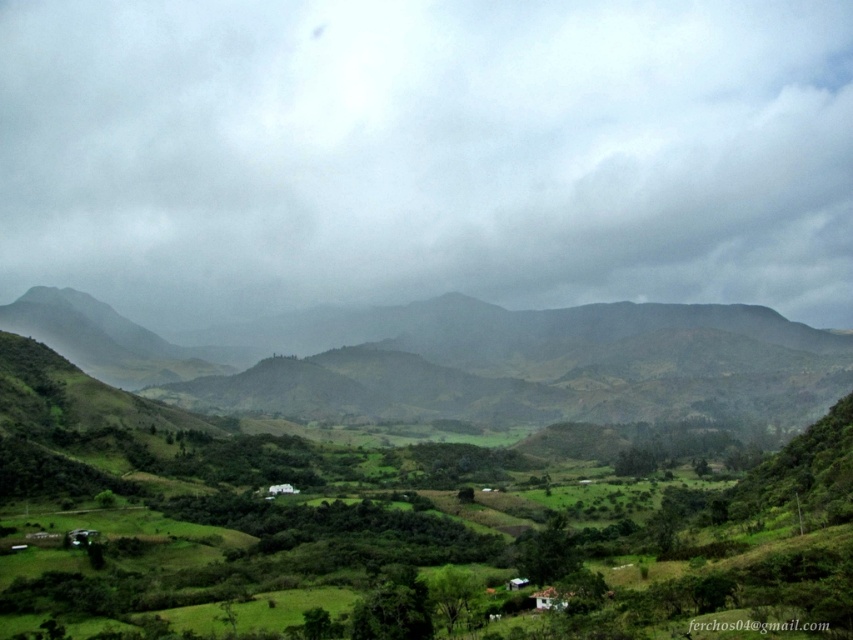
Between cloudy sky at upper center and green grassy hill at center, which one appears on the left side from the viewer's perspective?

green grassy hill at center

Is point (544, 291) farther from camera compared to point (755, 305)?

No, it is in front of (755, 305).

Identify the location of cloudy sky at upper center. pos(426,154).